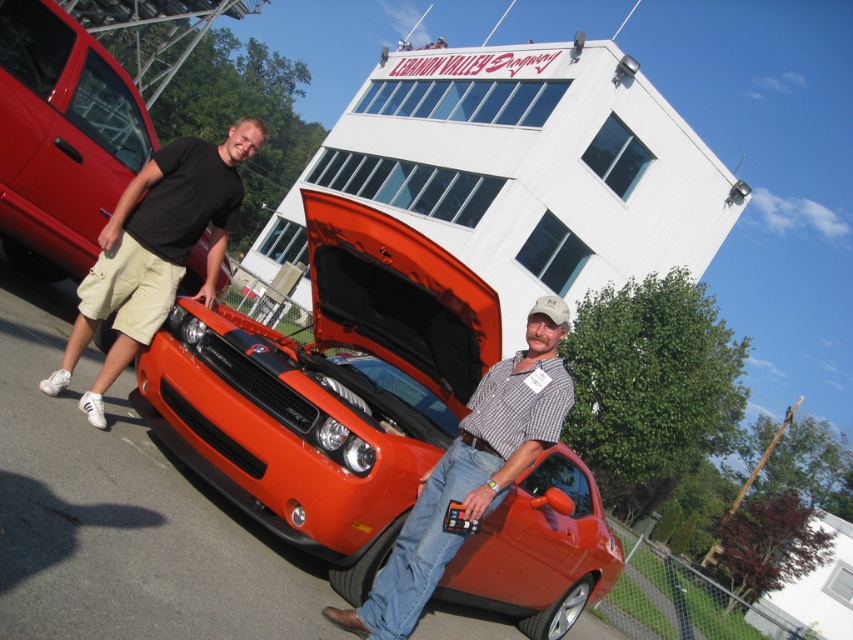
Does point (444, 394) come behind point (125, 330)?

Yes, it is.

Which is more to the right, shiny orange car at center or black cotton t-shirt at left?

Positioned to the right is shiny orange car at center.

Does point (352, 449) lie in front of point (161, 147)?

Yes.

Find the location of `shiny orange car at center`. shiny orange car at center is located at coordinates (328, 388).

Which is behind, point (432, 300) or point (82, 168)?

The point (82, 168) is behind.

Locate an element on the screen. The width and height of the screenshot is (853, 640). shiny orange car at center is located at coordinates (328, 388).

Does point (392, 365) lie in front of point (36, 232)?

Yes, it is in front of point (36, 232).

Where is `shiny orange car at center`? shiny orange car at center is located at coordinates (328, 388).

Identify the location of checkered fabric shirt at center. (471, 472).

Between checkered fabric shirt at center and black cotton t-shirt at left, which one appears on the left side from the viewer's perspective?

black cotton t-shirt at left

Between point (529, 349) and point (210, 154), which one is positioned behind?

Point (210, 154)

Locate an element on the screen. checkered fabric shirt at center is located at coordinates click(471, 472).